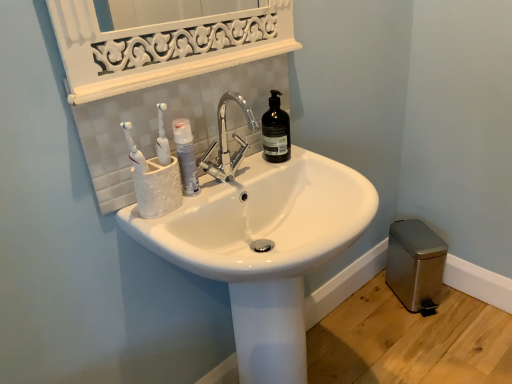
Question: Should I look upward or downward to see metallic gray trash can at lower right?

Choices:
 (A) up
 (B) down

Answer: (B)

Question: Can metallic gray trash can at lower right be found inside white glossy sink at center?

Choices:
 (A) no
 (B) yes

Answer: (A)

Question: Does white glossy sink at center turn towards metallic gray trash can at lower right?

Choices:
 (A) yes
 (B) no

Answer: (B)

Question: Considering the relative sizes of white glossy sink at center and metallic gray trash can at lower right in the image provided, is white glossy sink at center thinner than metallic gray trash can at lower right?

Choices:
 (A) yes
 (B) no

Answer: (B)

Question: Is white glossy sink at center directly adjacent to metallic gray trash can at lower right?

Choices:
 (A) yes
 (B) no

Answer: (B)

Question: Considering the relative positions of white glossy sink at center and metallic gray trash can at lower right in the image provided, is white glossy sink at center to the right of metallic gray trash can at lower right from the viewer's perspective?

Choices:
 (A) no
 (B) yes

Answer: (A)

Question: Is white glossy sink at center closer to the viewer compared to metallic gray trash can at lower right?

Choices:
 (A) no
 (B) yes

Answer: (B)

Question: Considering the relative sizes of metallic gray trash can at lower right and black matte bottle at upper center in the image provided, is metallic gray trash can at lower right thinner than black matte bottle at upper center?

Choices:
 (A) no
 (B) yes

Answer: (A)

Question: Does metallic gray trash can at lower right have a smaller size compared to black matte bottle at upper center?

Choices:
 (A) no
 (B) yes

Answer: (A)

Question: From a real-world perspective, is metallic gray trash can at lower right below black matte bottle at upper center?

Choices:
 (A) no
 (B) yes

Answer: (B)

Question: Is metallic gray trash can at lower right not within black matte bottle at upper center?

Choices:
 (A) no
 (B) yes

Answer: (B)

Question: Considering the relative sizes of metallic gray trash can at lower right and black matte bottle at upper center in the image provided, is metallic gray trash can at lower right taller than black matte bottle at upper center?

Choices:
 (A) no
 (B) yes

Answer: (B)

Question: Is metallic gray trash can at lower right positioned with its back to black matte bottle at upper center?

Choices:
 (A) yes
 (B) no

Answer: (B)

Question: Is white glossy mouthwash at center oriented away from white glossy sink at center?

Choices:
 (A) yes
 (B) no

Answer: (B)